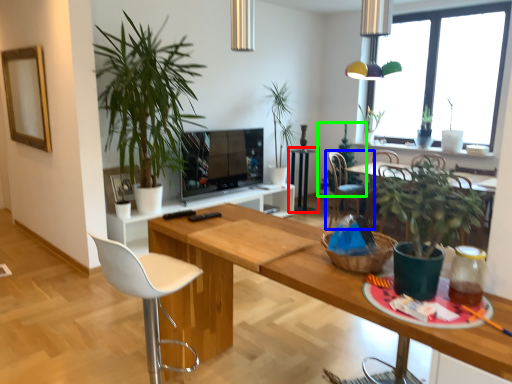
Question: Considering the real-world distances, which object is farthest from side table (highlighted by a red box)? chair (highlighted by a blue box) or houseplant (highlighted by a green box)?

Choices:
 (A) chair
 (B) houseplant

Answer: (B)